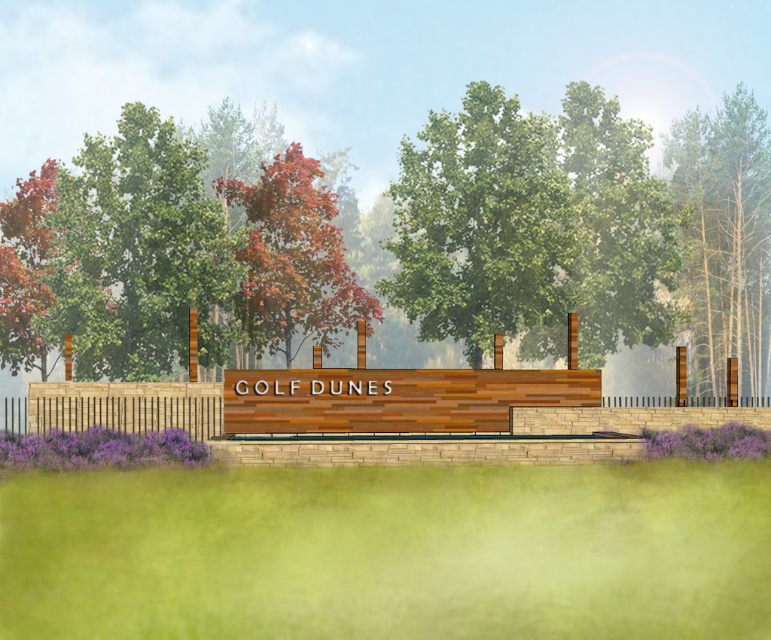
Question: Which point is closer to the camera taking this photo?

Choices:
 (A) (89, 337)
 (B) (281, 276)
 (C) (679, 118)
 (D) (520, 164)

Answer: (A)

Question: Which point is farther from the camera taking this photo?

Choices:
 (A) (507, 128)
 (B) (136, 428)
 (C) (88, 195)
 (D) (719, 332)

Answer: (D)

Question: Estimate the real-world distances between objects in this image. Which object is closer to the brown textured wood at right?

Choices:
 (A) reddish-brown wood tree at center
 (B) brown wooden fence at lower left
 (C) green leafy tree at center

Answer: (C)

Question: Can you confirm if green leafy tree at upper left is positioned to the left of reddish-brown wood tree at center?

Choices:
 (A) yes
 (B) no

Answer: (A)

Question: Observing the image, what is the correct spatial positioning of green leafy tree at center in reference to green leafy tree at upper left?

Choices:
 (A) left
 (B) right

Answer: (B)

Question: Can you confirm if reddish-brown wood tree at center is positioned to the right of brown wooden fence at lower left?

Choices:
 (A) no
 (B) yes

Answer: (B)